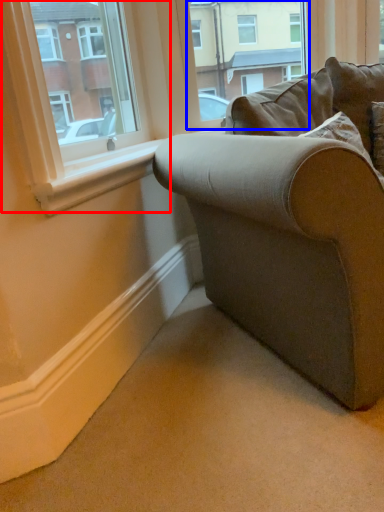
Question: Which point is closer to the camera, window (highlighted by a red box) or window frame (highlighted by a blue box)?

Choices:
 (A) window
 (B) window frame

Answer: (A)